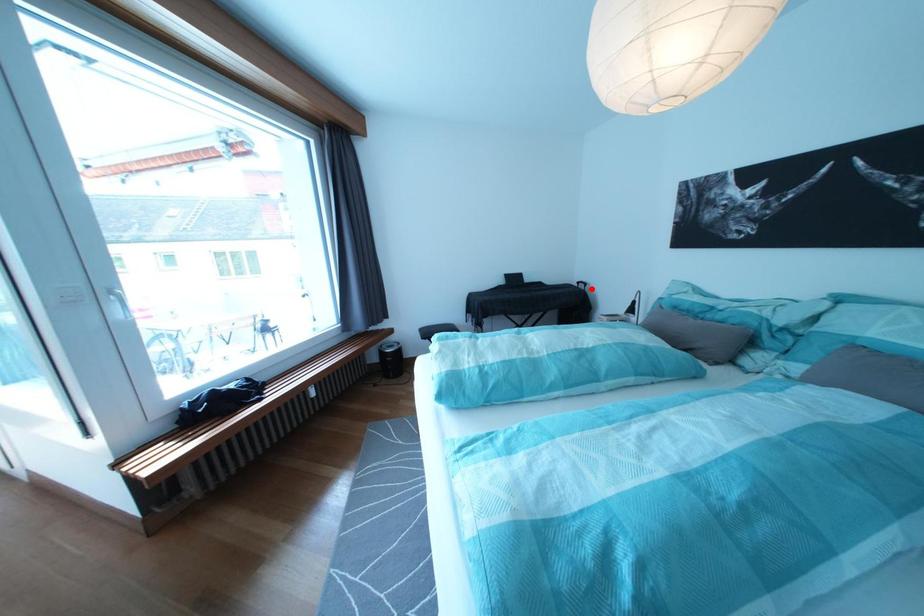
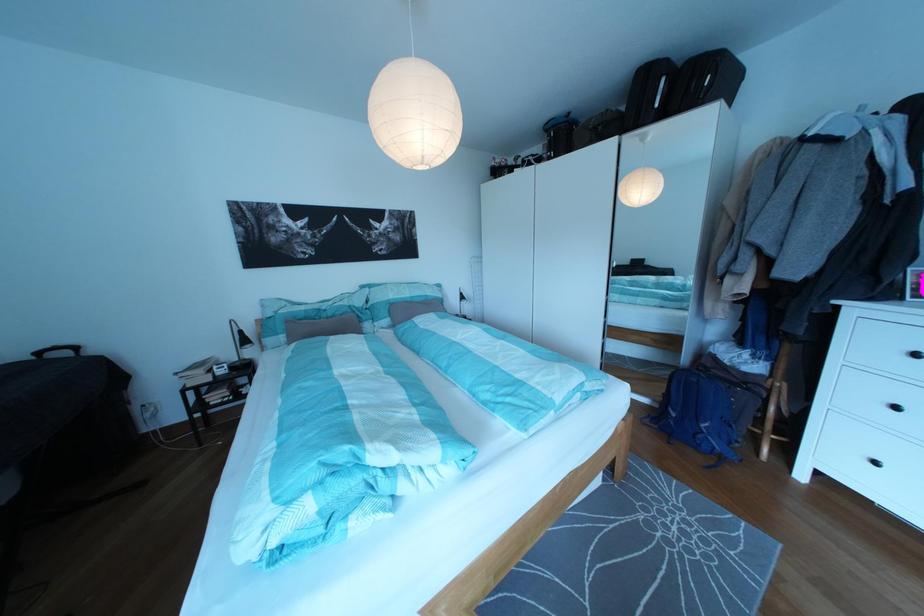
Locate, in the second image, the point that corresponds to the highlighted location in the first image.

(53, 360)